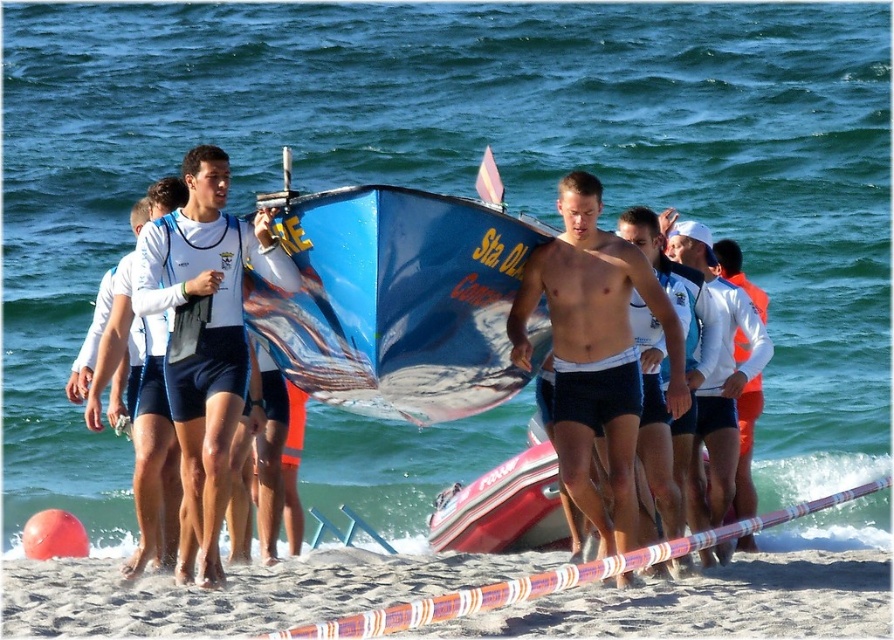
You are a member of the rescue team on the beach and need to reach both the point at coordinates [305,333] and the point at coordinates [648,220]. Which point should you reach first to ensure you can get to both efficiently?

You should reach point [305,333] first because it is closer to you than point [648,220]. This allows you to efficiently proceed to the farther point afterward.